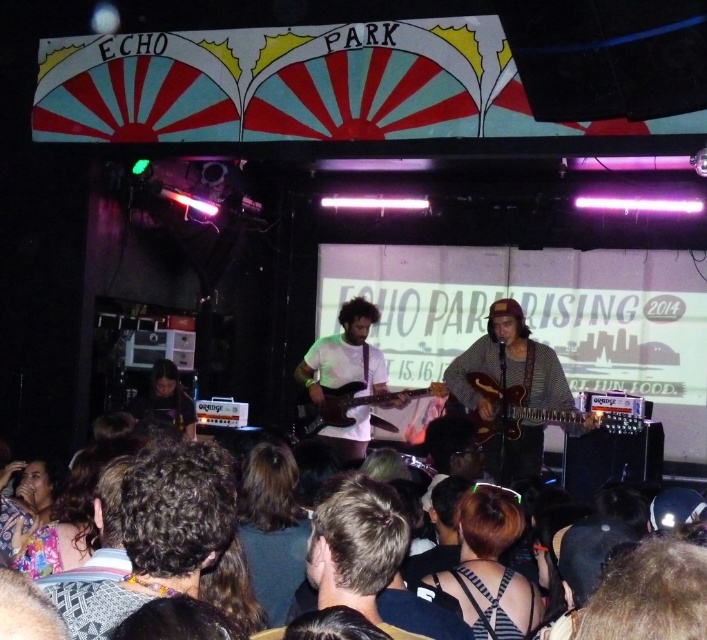
Question: Is brown hair at center closer to the viewer compared to wooden guitar at center?

Choices:
 (A) yes
 (B) no

Answer: (A)

Question: Which of the following is the closest to the observer?

Choices:
 (A) tap(370, 580)
 (B) tap(358, 401)
 (C) tap(148, 547)
 (D) tap(467, 499)

Answer: (C)

Question: In this image, where is black mesh top at center located relative to dark brown hair at center?

Choices:
 (A) left
 (B) right

Answer: (B)

Question: Is black mesh top at center further to the viewer compared to floral fabric face at lower left?

Choices:
 (A) no
 (B) yes

Answer: (A)

Question: Among these points, which one is nearest to the camera?

Choices:
 (A) (518, 320)
 (B) (222, 492)
 (C) (344, 499)
 (D) (462, 563)

Answer: (B)

Question: Estimate the real-world distances between objects in this image. Which object is closer to the floral fabric face at lower left?

Choices:
 (A) white matte guitar at center
 (B) curly hair at lower left
 (C) brown hair at center
 (D) wooden guitar at center

Answer: (B)